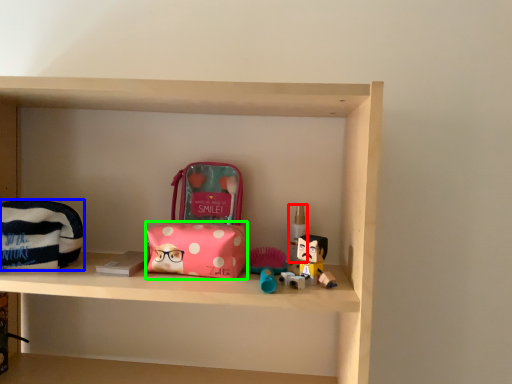
Question: Which object is the farthest from toiletry (highlighted by a red box)? Choose among these: pouch (highlighted by a blue box) or package (highlighted by a green box).

Choices:
 (A) pouch
 (B) package

Answer: (A)